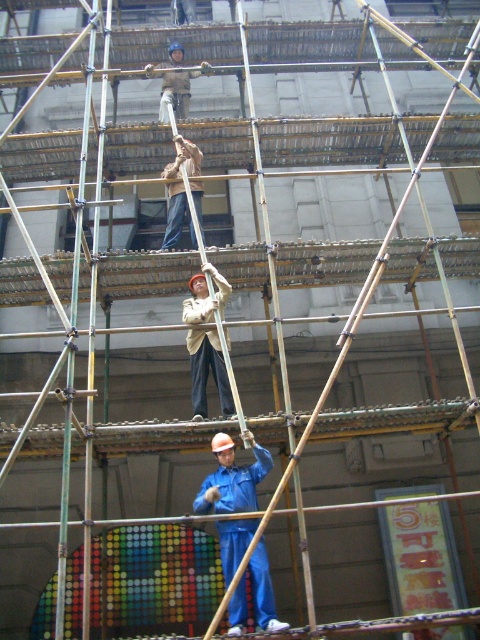
Question: Which point is farther to the camera?

Choices:
 (A) click(68, 316)
 (B) click(216, 275)
 (C) click(253, 573)
 (D) click(181, 56)

Answer: (D)

Question: Is green bamboo scaffolding at center below light brown fabric construction worker at upper center?

Choices:
 (A) no
 (B) yes

Answer: (B)

Question: Is green bamboo scaffolding at center wider than light brown fabric construction worker at upper center?

Choices:
 (A) no
 (B) yes

Answer: (B)

Question: Estimate the real-world distances between objects in this image. Which object is farther from the green bamboo scaffolding at center?

Choices:
 (A) light brown fabric construction worker at upper center
 (B) light beige fabric jacket at center
 (C) blue matte jumpsuit at center

Answer: (A)

Question: Is green bamboo scaffolding at center below light brown fabric construction worker at upper center?

Choices:
 (A) no
 (B) yes

Answer: (B)

Question: Which point is farther to the camera?

Choices:
 (A) light beige fabric jacket at center
 (B) light brown fabric construction worker at upper center
 (C) blue matte jumpsuit at center

Answer: (B)